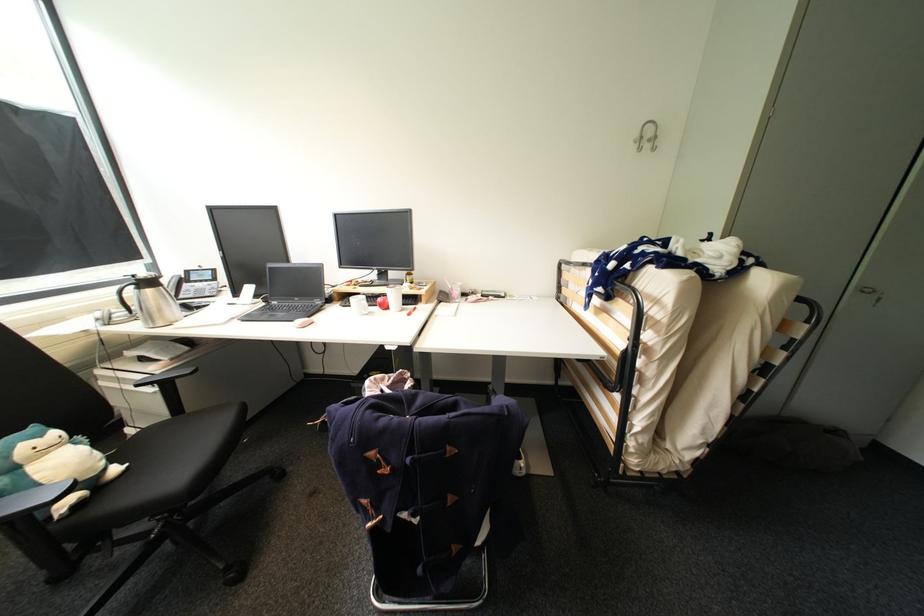
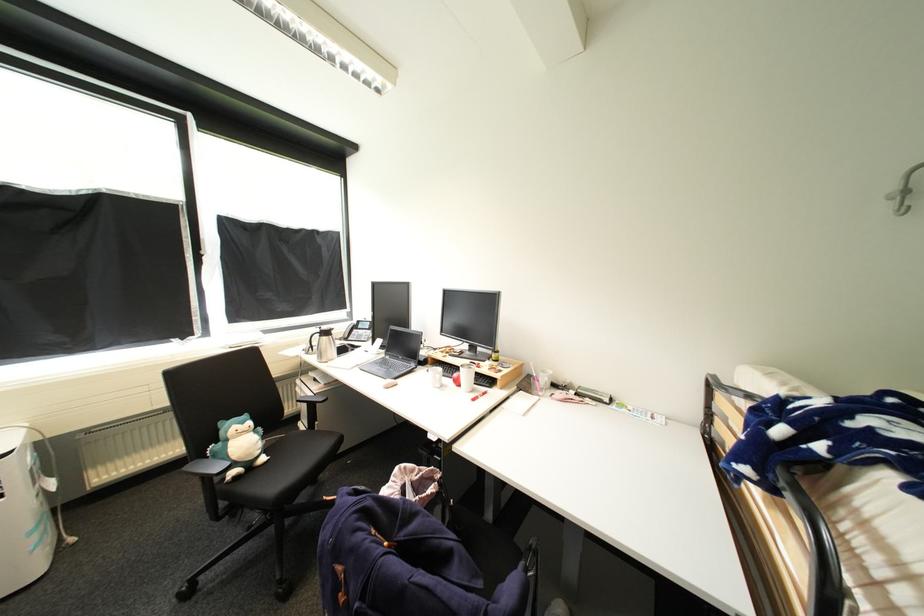
Find the pixel in the second image that matches the point at 202,282 in the first image.

(367, 330)